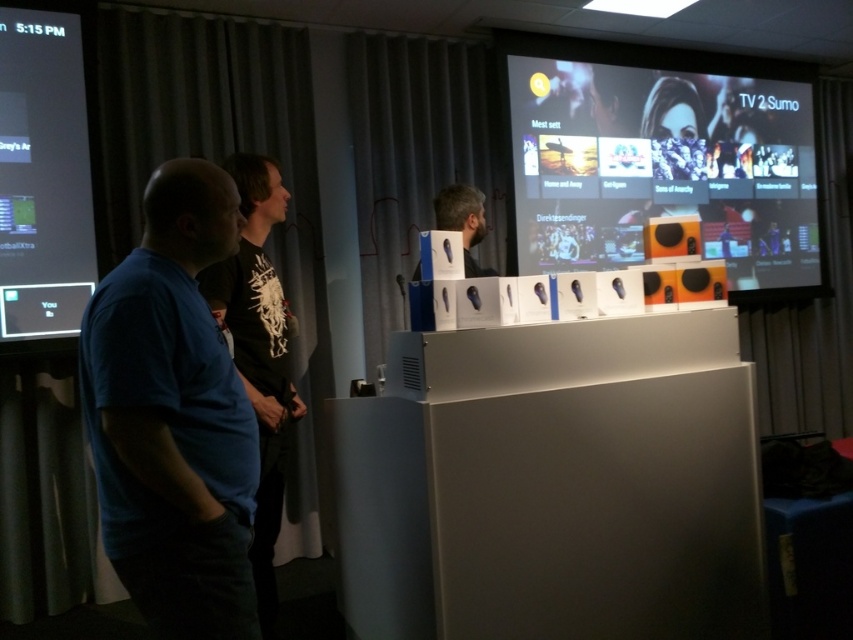
Question: Can you confirm if matte black screen at upper right is positioned to the right of matte black headphones at center?

Choices:
 (A) yes
 (B) no

Answer: (A)

Question: Is blue cotton shirt at left in front of matte black screen at left?

Choices:
 (A) no
 (B) yes

Answer: (B)

Question: Is the position of matte black screen at upper right less distant than that of matte black screen at left?

Choices:
 (A) no
 (B) yes

Answer: (A)

Question: Which of the following is the farthest from the observer?

Choices:
 (A) (53, 96)
 (B) (438, 205)

Answer: (A)

Question: Which of the following is the closest to the observer?

Choices:
 (A) (119, 492)
 (B) (85, 100)
 (C) (241, 284)
 (D) (468, 260)

Answer: (A)

Question: Among these objects, which one is farthest from the camera?

Choices:
 (A) black t-shirt at left
 (B) matte black screen at upper right
 (C) blue cotton shirt at left

Answer: (B)